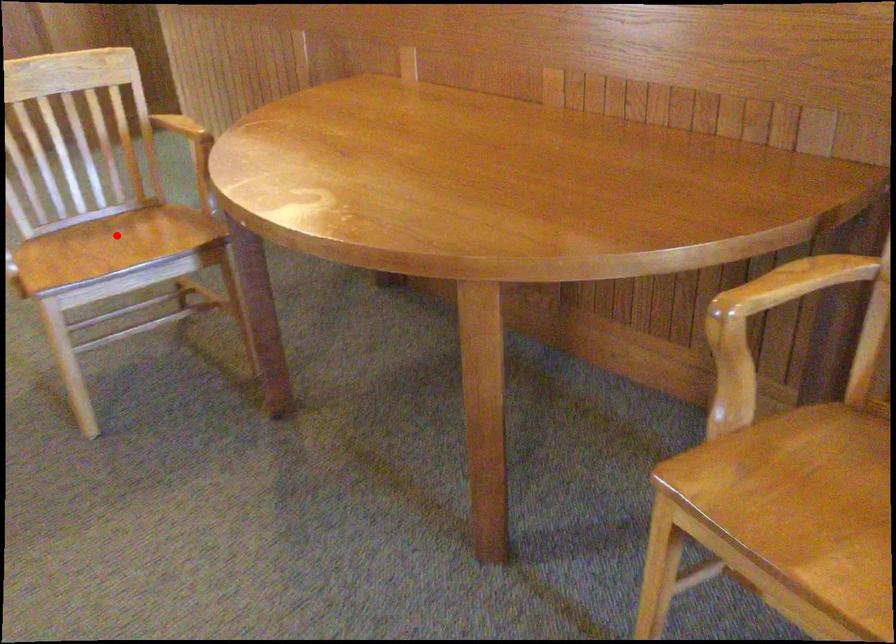
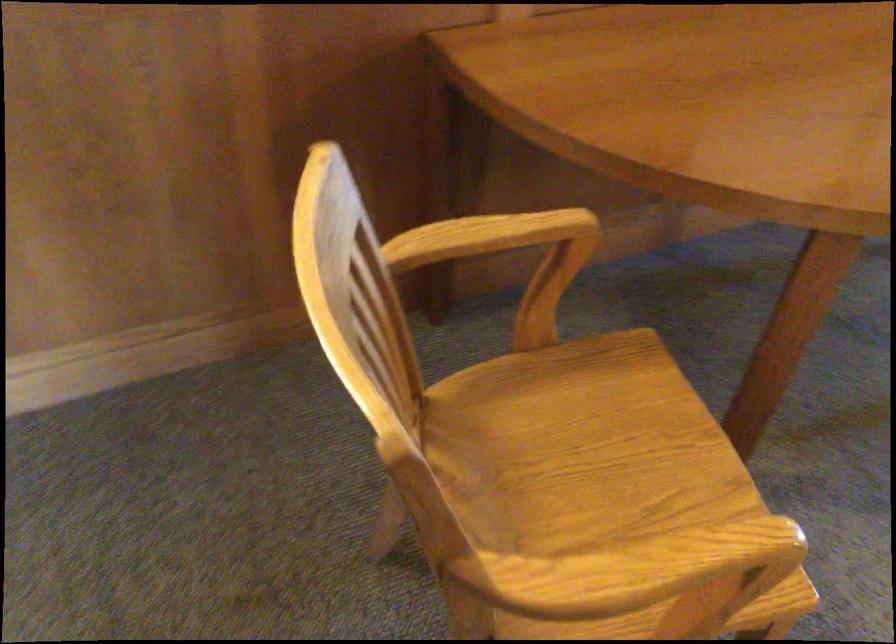
Question: I am providing you with two images of the same scene from different viewpoints. Image1 has a red point marked. In image2, the corresponding 3D location appears at what relative position? Reply with the corresponding letter.

Choices:
 (A) Closer
 (B) Farther

Answer: (A)